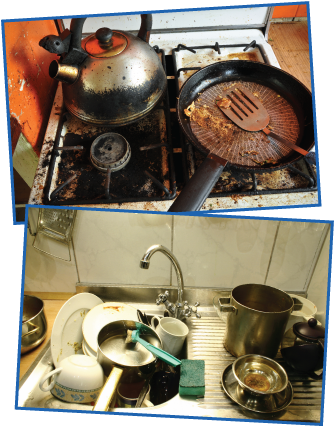
Where is `stack of dirty dishes in sink`? This screenshot has height=427, width=335. stack of dirty dishes in sink is located at coordinates (102, 316).